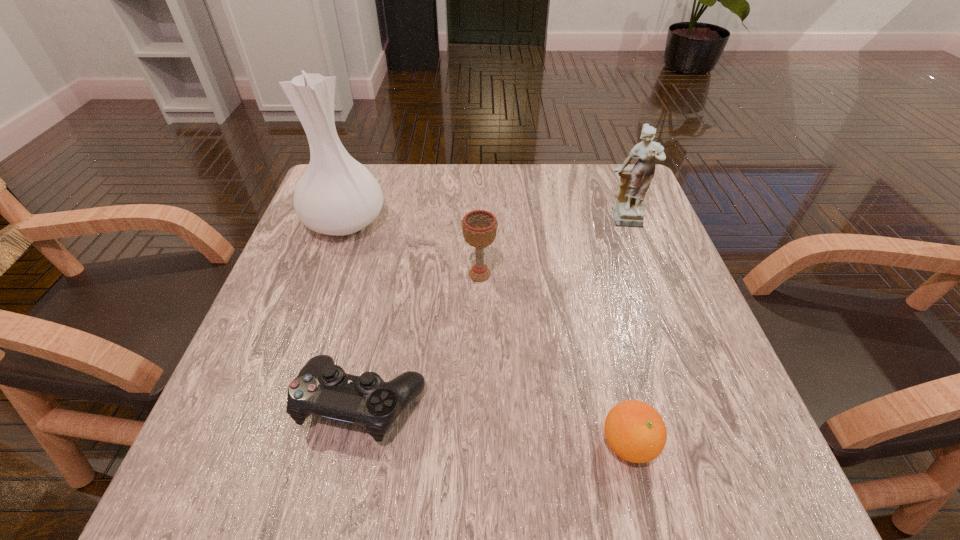
What are the coordinates of `vase` in the screenshot? It's located at (337, 195).

Where is `figurine`? figurine is located at coordinates (628, 211).

At what (x,y) coordinates should I click in order to perform the action: click on the second tallest object. Please return your answer as a coordinate pair (x, y). Looking at the image, I should click on (628, 211).

This screenshot has height=540, width=960. Find the location of `the third shortest object`. the third shortest object is located at coordinates (479, 227).

Identify the location of chalice. (479, 227).

Identify the location of control. This screenshot has height=540, width=960. (321, 388).

Identify the location of the second object from right to left. (635, 431).

At what (x,y) coordinates should I click in order to perform the action: click on free space located 0.300m on the right of the vase. Please return your answer as a coordinate pair (x, y). This screenshot has width=960, height=540. Looking at the image, I should click on (514, 222).

The height and width of the screenshot is (540, 960). I want to click on vacant point located on the front-facing side of the rightmost object, so click(x=675, y=360).

You are a GUI agent. You are given a task and a screenshot of the screen. Output one action in this format:
    pyautogui.click(x=<x>, y=<y>)
    Task: Click on the vacant space located on the right of the third farthest object
    Image resolution: width=960 pixels, height=540 pixels.
    Given the screenshot: What is the action you would take?
    pyautogui.click(x=680, y=274)